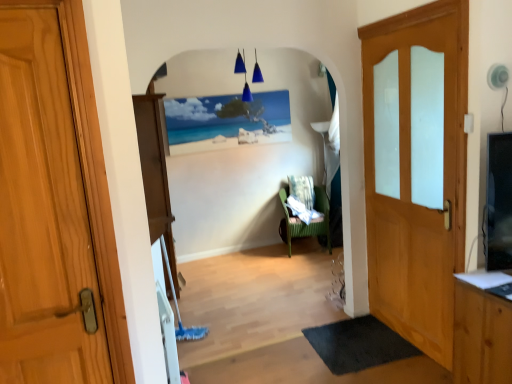
Question: Is wooden door at left, placed as the first door when sorted from front to back, to the left or to the right of wooden door with frosted glass panels at right, the 2th door positioned from the left, in the image?

Choices:
 (A) left
 (B) right

Answer: (A)

Question: Is point (31, 263) positioned closer to the camera than point (375, 294)?

Choices:
 (A) farther
 (B) closer

Answer: (B)

Question: Estimate the real-world distances between objects in this image. Which object is farther from the green wicker chair at center?

Choices:
 (A) wooden door with frosted glass panels at right, the 1th door in the right-to-left sequence
 (B) wooden door at left, the 1th door in the left-to-right sequence
 (C) black rubber mat at lower right
 (D) matte wooden picture frame at center

Answer: (B)

Question: Which object is the closest to the wooden door with frosted glass panels at right, the 2th door positioned from the left?

Choices:
 (A) wooden door at left, placed as the first door when sorted from front to back
 (B) green wicker chair at center
 (C) matte wooden picture frame at center
 (D) black rubber mat at lower right

Answer: (D)